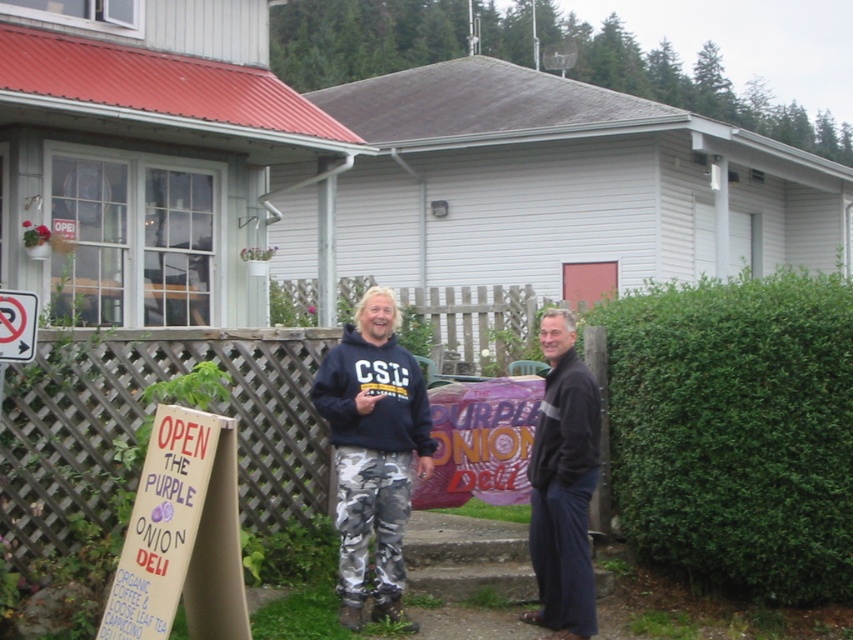
Is wooden signboard at lower left below white plastic sign at upper left?

Yes.

Between wooden signboard at lower left and white plastic sign at upper left, which one appears on the right side from the viewer's perspective?

wooden signboard at lower left is more to the right.

Is point (231, 608) positioned in front of point (13, 349)?

Yes, point (231, 608) is in front of point (13, 349).

Where is `wooden signboard at lower left`? The width and height of the screenshot is (853, 640). wooden signboard at lower left is located at coordinates (183, 536).

Who is higher up, wooden signboard at lower left or dark blue fabric at right?

dark blue fabric at right is higher up.

Which is in front, point (132, 557) or point (577, 426)?

Point (132, 557) is more forward.

Where is `wooden signboard at lower left`? Image resolution: width=853 pixels, height=640 pixels. wooden signboard at lower left is located at coordinates (183, 536).

Is point (183, 518) more distant than point (387, 304)?

That is False.

Between wooden signboard at lower left and camo pants at center, which one has less height?

wooden signboard at lower left is shorter.

This screenshot has height=640, width=853. What are the coordinates of `wooden signboard at lower left` in the screenshot? It's located at pos(183,536).